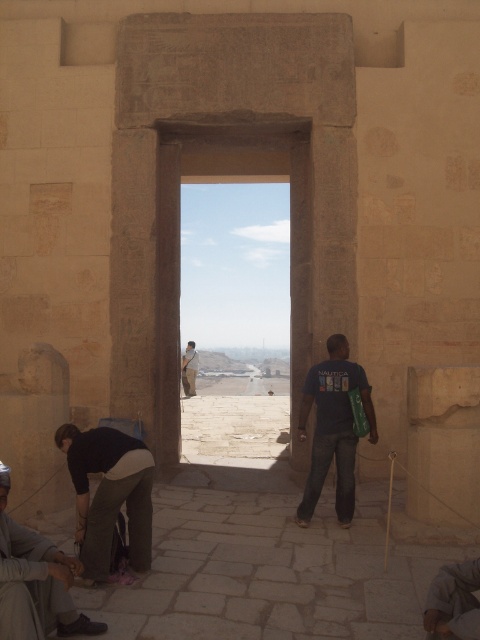
Question: Does dark gray pants at lower left have a larger size compared to dark gray fabric shoe at lower left?

Choices:
 (A) no
 (B) yes

Answer: (A)

Question: Among these objects, which one is nearest to the camera?

Choices:
 (A) dark gray fabric shoe at lower left
 (B) dark blue t-shirt at center

Answer: (A)

Question: Is dark gray pants at lower left positioned at the back of dark gray fabric shoe at lower left?

Choices:
 (A) no
 (B) yes

Answer: (B)

Question: Which point is farther to the camera?

Choices:
 (A) beige stone archway at center
 (B) light brown fabric at center
 (C) dark gray fabric shoe at lower left
 (D) dark gray pants at lower left

Answer: (B)

Question: Is dark gray pants at lower left bigger than dark blue t-shirt at center?

Choices:
 (A) yes
 (B) no

Answer: (B)

Question: Which object appears closest to the camera in this image?

Choices:
 (A) dark gray fabric shoe at lower left
 (B) beige stone archway at center

Answer: (A)